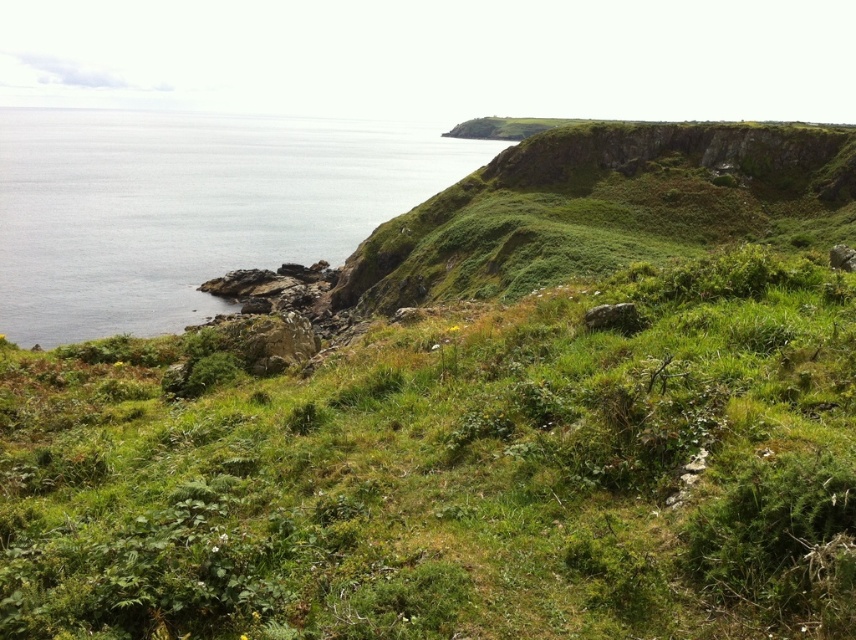
Who is positioned more to the right, green grassy at center or clear blue water at left?

From the viewer's perspective, green grassy at center appears more on the right side.

Between green grassy at center and clear blue water at left, which one appears on the left side from the viewer's perspective?

Positioned to the left is clear blue water at left.

Is point (718, 529) less distant than point (218, 236)?

Yes, it is in front of point (218, 236).

Find the location of a particular element. This screenshot has height=640, width=856. green grassy at center is located at coordinates (453, 474).